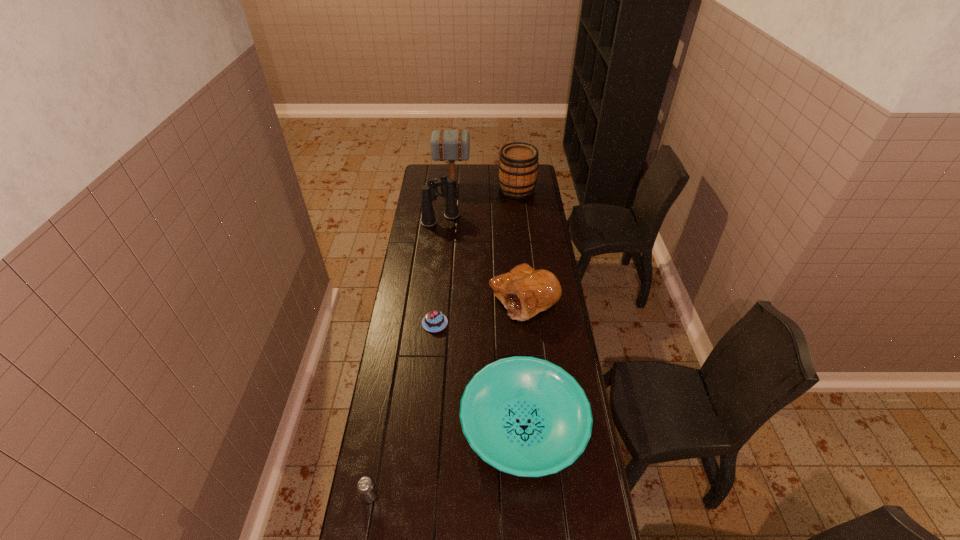
At what (x,y) coordinates should I click in order to perform the action: click on free spot located on the filling side of the bread. Please return your answer as a coordinate pair (x, y). The image size is (960, 540). Looking at the image, I should click on (446, 299).

Identify the location of vacant region located 0.200m on the filling side of the bread. (444, 299).

The image size is (960, 540). In order to click on free point located on the filling side of the bread in this screenshot , I will do `click(460, 299)`.

Identify the location of vacant point located on the back of the dish. This screenshot has height=540, width=960. (516, 316).

Where is `blank area located 0.070m on the front of the leftmost object`? blank area located 0.070m on the front of the leftmost object is located at coordinates (364, 529).

Find the location of a particular element. This screenshot has height=540, width=960. vacant point located on the back of the chocolate cake is located at coordinates (440, 269).

Image resolution: width=960 pixels, height=540 pixels. In order to click on mallet present at the far edge in this screenshot , I will do `click(446, 145)`.

At what (x,y) coordinates should I click in order to perform the action: click on cider present at the far edge. Please return your answer as a coordinate pair (x, y). The image size is (960, 540). Looking at the image, I should click on [518, 165].

The width and height of the screenshot is (960, 540). In order to click on mallet situated at the left edge in this screenshot , I will do `click(446, 145)`.

Identify the location of binoculars that is at the left edge. (447, 187).